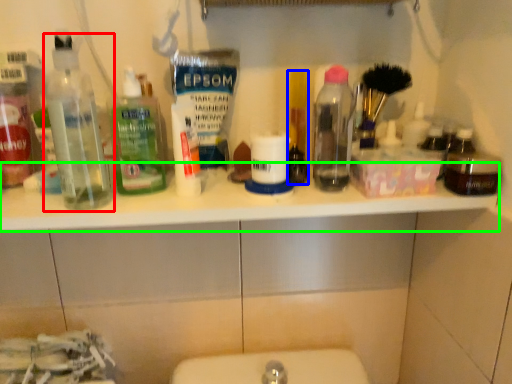
Question: Based on their relative distances, which object is nearer to bottle (highlighted by a red box)? Choose from personal care (highlighted by a blue box) and counter top (highlighted by a green box).

Choices:
 (A) personal care
 (B) counter top

Answer: (B)